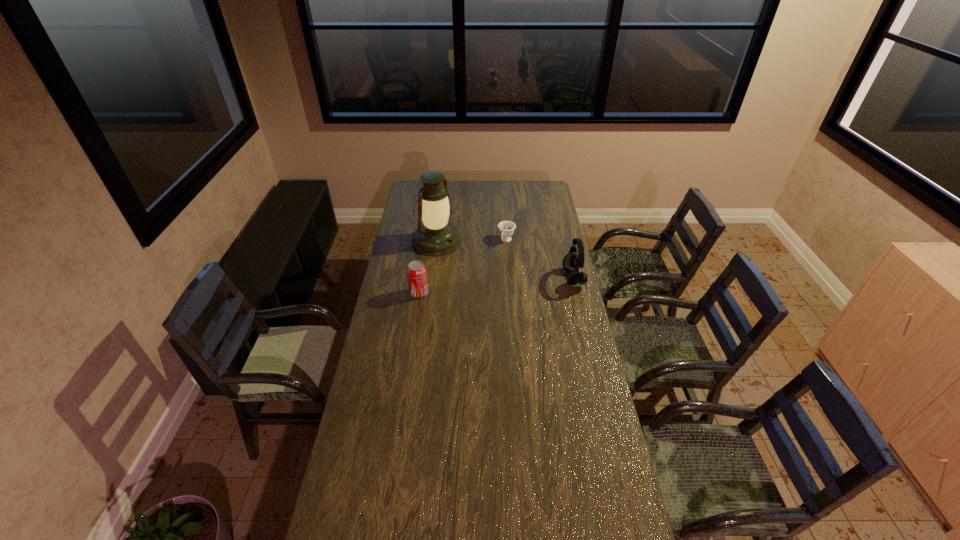
Where is `empty location between the teacup and the soda can`? empty location between the teacup and the soda can is located at coordinates (463, 267).

Where is `free space between the shortest object and the third tallest object`? Image resolution: width=960 pixels, height=540 pixels. free space between the shortest object and the third tallest object is located at coordinates (463, 267).

Locate an element on the screen. This screenshot has height=540, width=960. free space that is in between the third shortest object and the third tallest object is located at coordinates (496, 286).

This screenshot has height=540, width=960. What are the coordinates of `vacant area that lies between the shortest object and the third tallest object` in the screenshot? It's located at (463, 267).

Identify the location of free space between the third object from left to right and the lantern. Image resolution: width=960 pixels, height=540 pixels. (471, 240).

Image resolution: width=960 pixels, height=540 pixels. I want to click on vacant area between the headset and the second shortest object, so (x=496, y=286).

Choose which object is the third nearest neighbor to the lantern. Please provide its 2D coordinates. Your answer should be formatted as a tuple, i.e. [(x, y)], where the tuple contains the x and y coordinates of a point satisfying the conditions above.

[(573, 263)]

This screenshot has height=540, width=960. What are the coordinates of `object that is the third closest to the second shortest object` in the screenshot? It's located at (573, 263).

Where is `vacant space that satisfies the following two spatial constraints: 1. on the front side of the rightmost object; 2. on the ear cups of the shortest object`? The height and width of the screenshot is (540, 960). vacant space that satisfies the following two spatial constraints: 1. on the front side of the rightmost object; 2. on the ear cups of the shortest object is located at coordinates (509, 279).